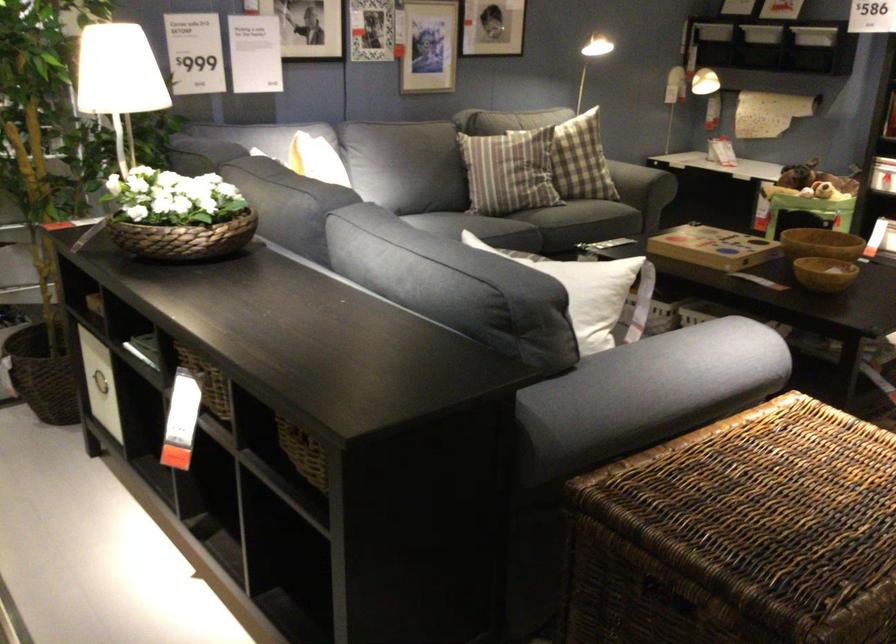
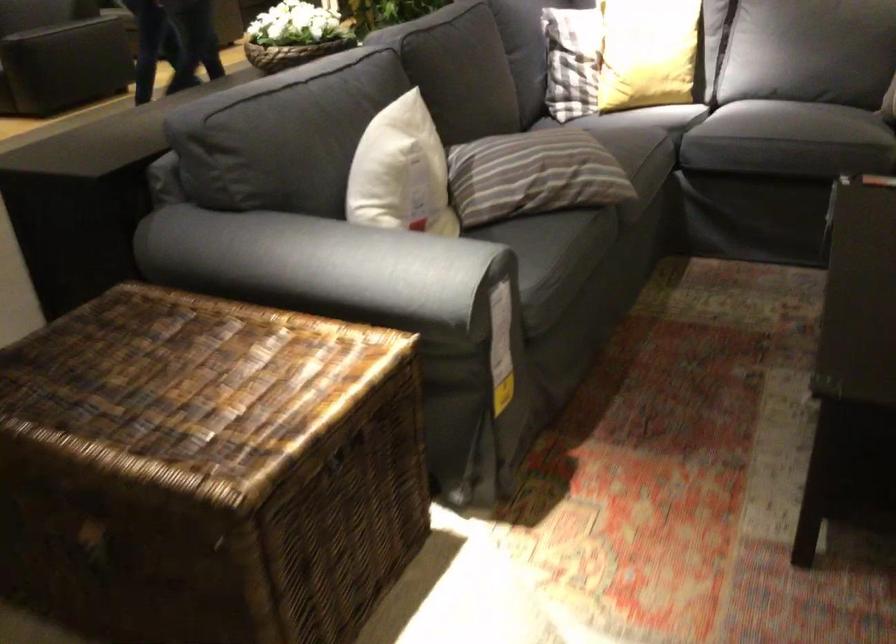
Find the pixel in the second image that matches point 633,366 in the first image.

(304, 265)